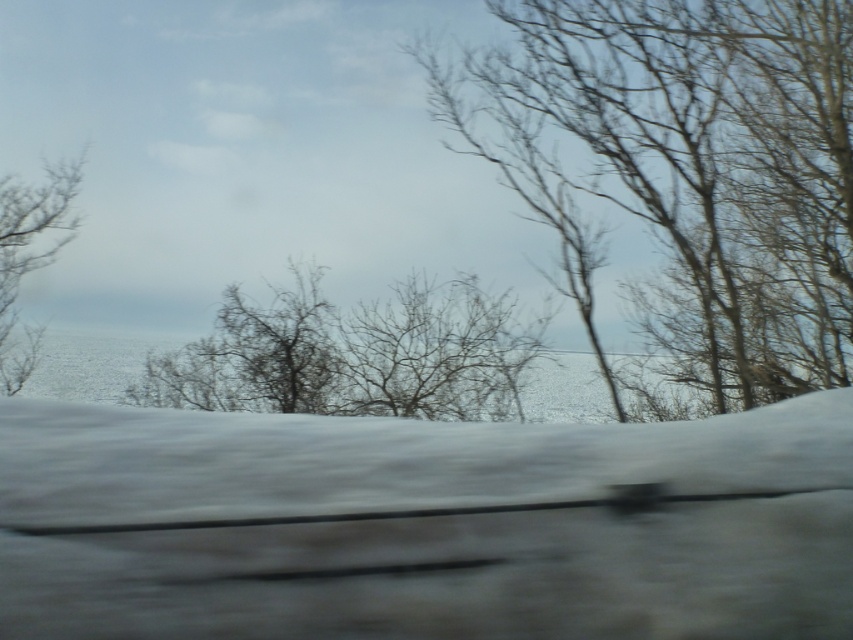
Question: Which point is closer to the camera?

Choices:
 (A) bare branches at right
 (B) bare branches at center
 (C) bare branches at left

Answer: (A)

Question: Which of the following is the farthest from the observer?

Choices:
 (A) bare branches at right
 (B) bare branches at center

Answer: (B)

Question: Does bare branches at right have a greater width compared to bare branches at center?

Choices:
 (A) yes
 (B) no

Answer: (A)

Question: Which point is farther from the camera taking this photo?

Choices:
 (A) (45, 211)
 (B) (612, 154)
 (C) (397, 320)

Answer: (C)

Question: Is bare branches at right in front of bare branches at left?

Choices:
 (A) yes
 (B) no

Answer: (A)

Question: From the image, what is the correct spatial relationship of bare branches at right in relation to bare branches at center?

Choices:
 (A) left
 (B) right

Answer: (B)